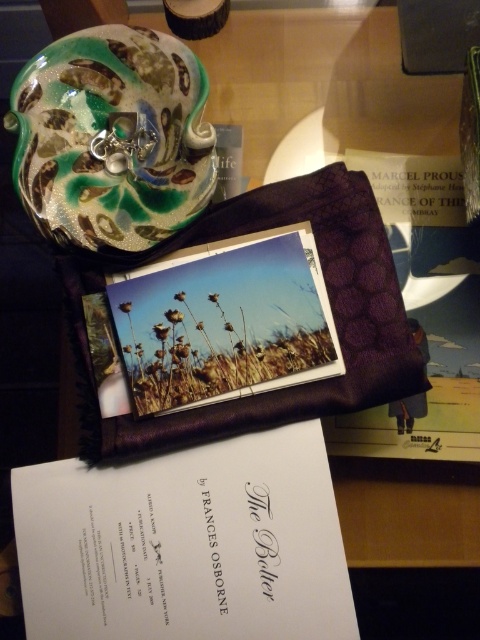
You are standing at the edge of the wooden surface looking at the two points marked in the scene. Which point is closer to you, point (183, 48) or point (113, 429)?

Point (113, 429) is closer to you because point (183, 48) is behind it.

You are organizing items on a desk and need to place a new item. The shiny ceramic plate at upper left is represented by point (x=111, y=138). Where should you place the new item to ensure it doesn not overlap with the shiny ceramic plate at upper left?

Place the new item anywhere except the coordinates (x=111, y=138) to avoid overlapping with the shiny ceramic plate at upper left.

You are organizing items on a desk and need to stack the shiny ceramic plate at upper left and the purple quilted folder at center. Which item should you place at the bottom to ensure stability?

The shiny ceramic plate at upper left has a lesser height compared to the purple quilted folder at center, so you should place the purple quilted folder at center at the bottom for stability.